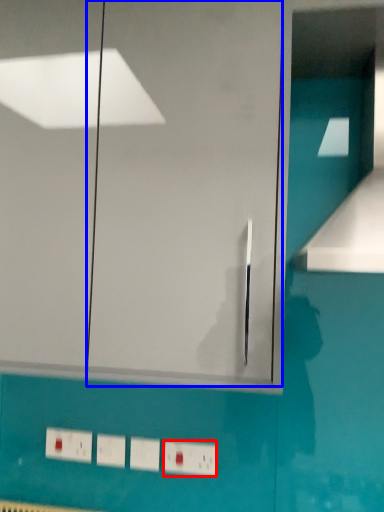
Question: Which point is further to the camera, switch (highlighted by a red box) or glass door (highlighted by a blue box)?

Choices:
 (A) switch
 (B) glass door

Answer: (A)